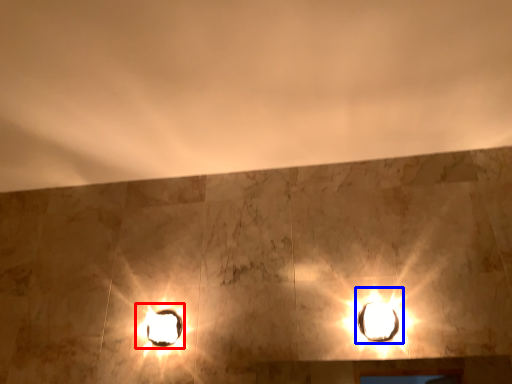
Question: Which object appears farthest to the camera in this image, stage light (highlighted by a red box) or lamp (highlighted by a blue box)?

Choices:
 (A) stage light
 (B) lamp

Answer: (A)